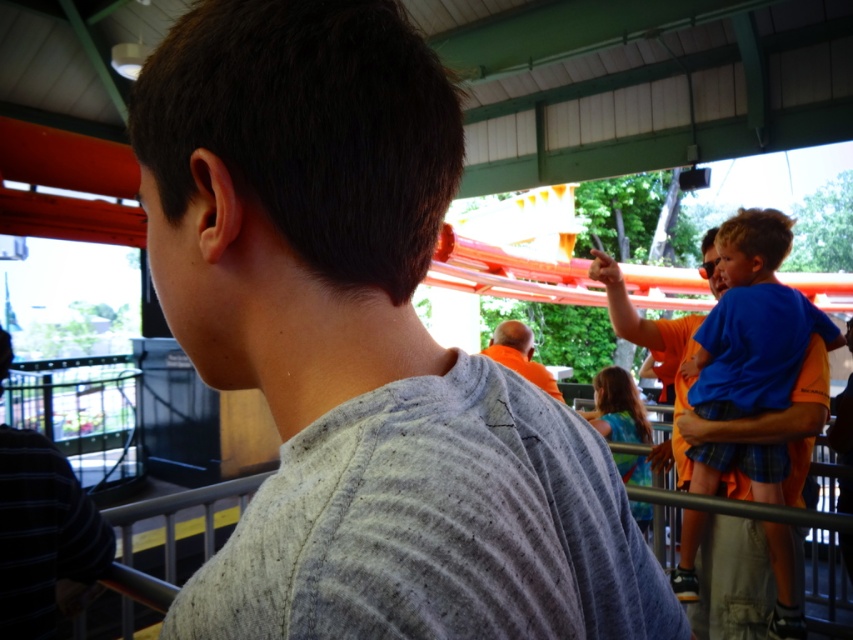
Question: Among these points, which one is nearest to the camera?

Choices:
 (A) (352, 477)
 (B) (689, 445)
 (C) (619, 372)

Answer: (A)

Question: Is blue denim shirt at center to the right of orange cotton shirt at center from the viewer's perspective?

Choices:
 (A) yes
 (B) no

Answer: (A)

Question: Does gray cotton shirt at center appear over striped cotton shirt at left?

Choices:
 (A) yes
 (B) no

Answer: (A)

Question: Does gray cotton shirt at center have a larger size compared to blue cotton shirt at right?

Choices:
 (A) no
 (B) yes

Answer: (A)

Question: Which object appears farthest from the camera in this image?

Choices:
 (A) orange cotton shirt at center
 (B) striped cotton shirt at left

Answer: (B)

Question: Which point is farther to the camera?

Choices:
 (A) (643, 534)
 (B) (9, 592)

Answer: (A)